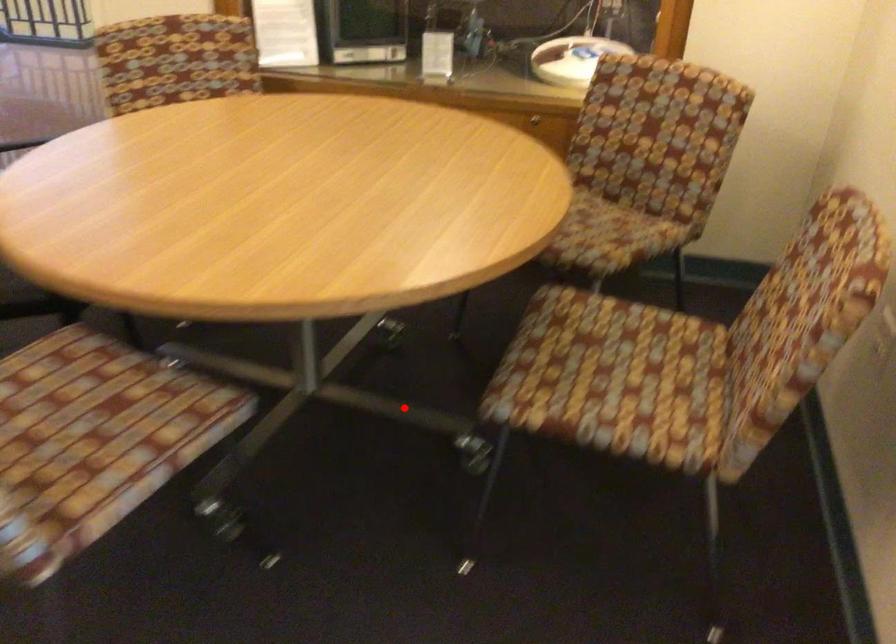
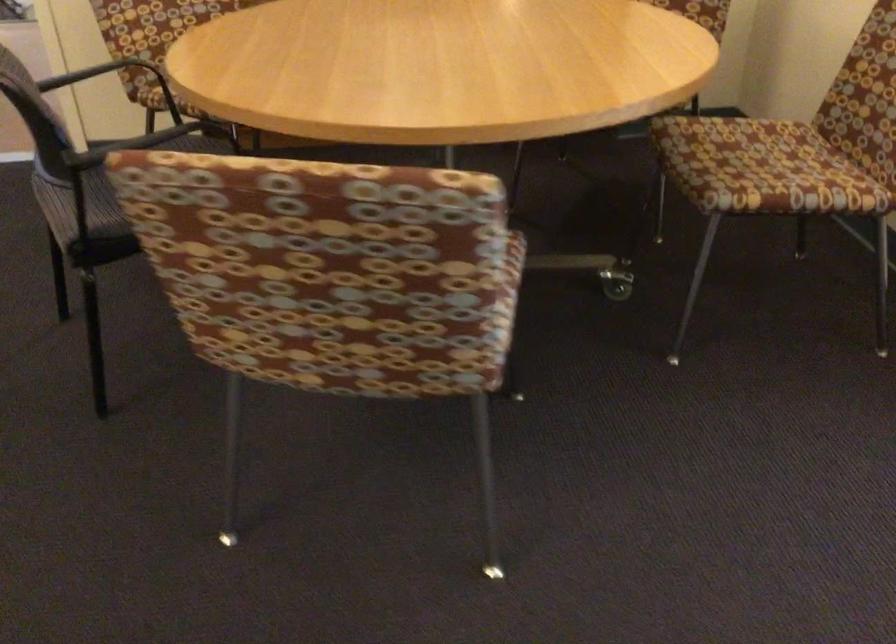
Locate, in the second image, the point that corresponds to the highlighted location in the first image.

(546, 254)